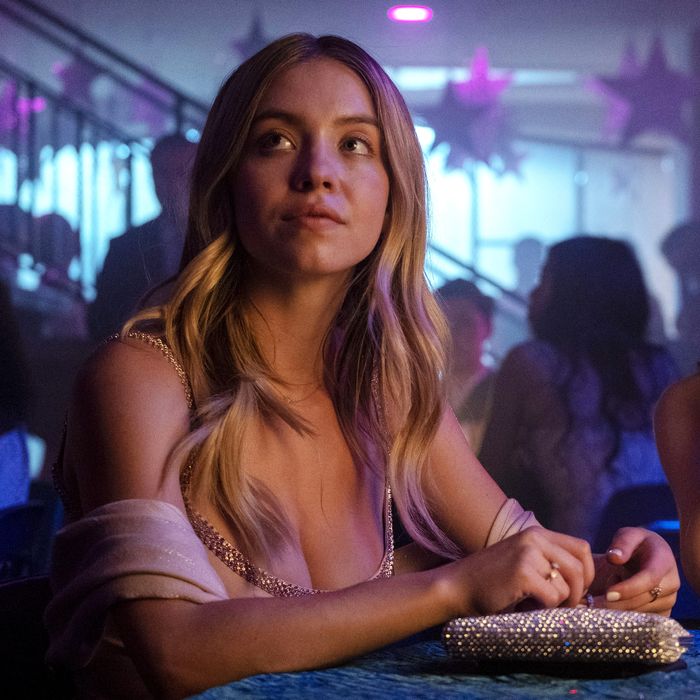
Identify the location of table. The height and width of the screenshot is (700, 700). (407, 685).